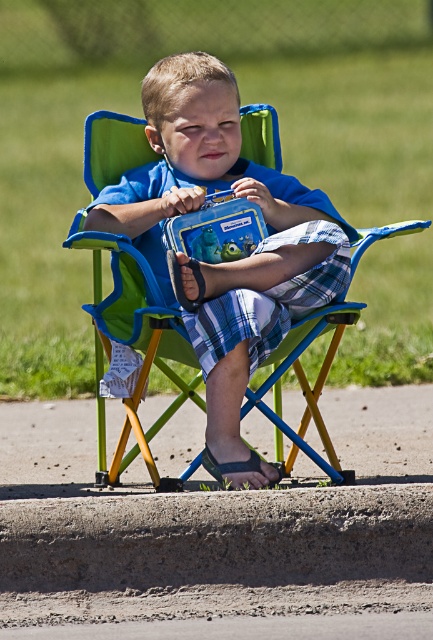
Question: Which of the following is the closest to the observer?

Choices:
 (A) (142, 170)
 (B) (239, 461)

Answer: (B)

Question: In this image, where is blue fabric boy at center located relative to black fabric sandal at lower center?

Choices:
 (A) below
 (B) above

Answer: (B)

Question: Does blue fabric boy at center come in front of black fabric sandal at lower center?

Choices:
 (A) yes
 (B) no

Answer: (A)

Question: Among these points, which one is nearest to the camera?

Choices:
 (A) (207, 465)
 (B) (197, 96)

Answer: (A)

Question: Does blue fabric boy at center have a larger size compared to black fabric sandal at lower center?

Choices:
 (A) no
 (B) yes

Answer: (B)

Question: Which object is farther from the camera taking this photo?

Choices:
 (A) black fabric sandal at lower center
 (B) blue fabric boy at center

Answer: (A)